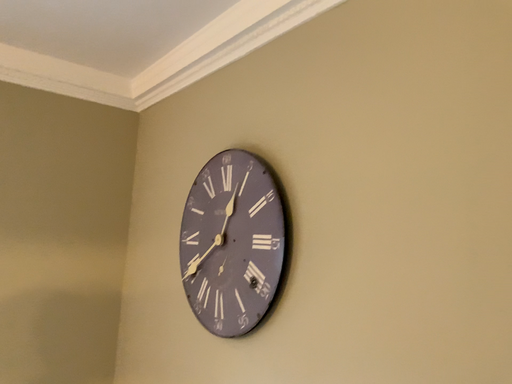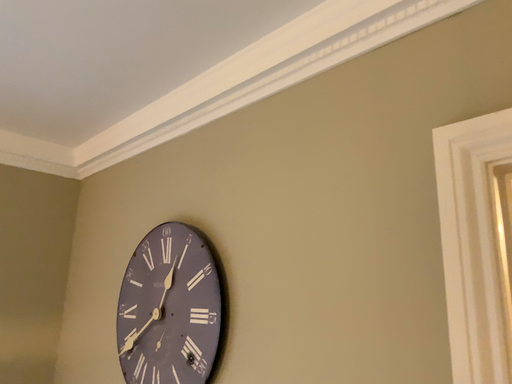
Question: How did the camera likely rotate when shooting the video?

Choices:
 (A) rotated downward
 (B) rotated upward

Answer: (B)